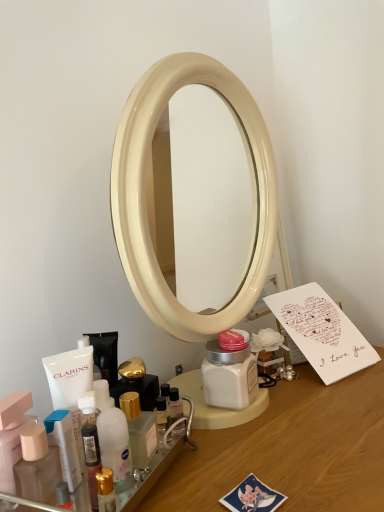
I want to click on free area below white paper card at right (from a real-world perspective), so click(x=340, y=396).